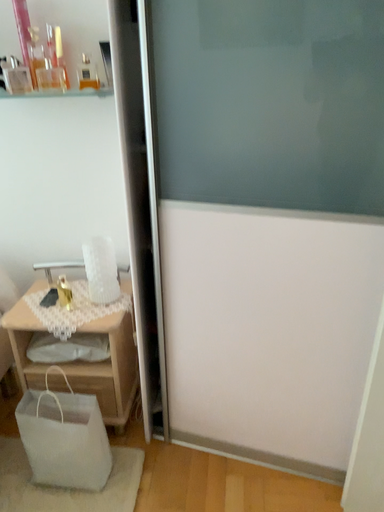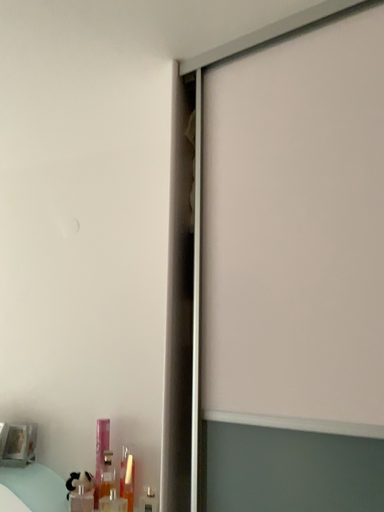
Question: Which way did the camera rotate in the video?

Choices:
 (A) rotated left
 (B) rotated right

Answer: (A)